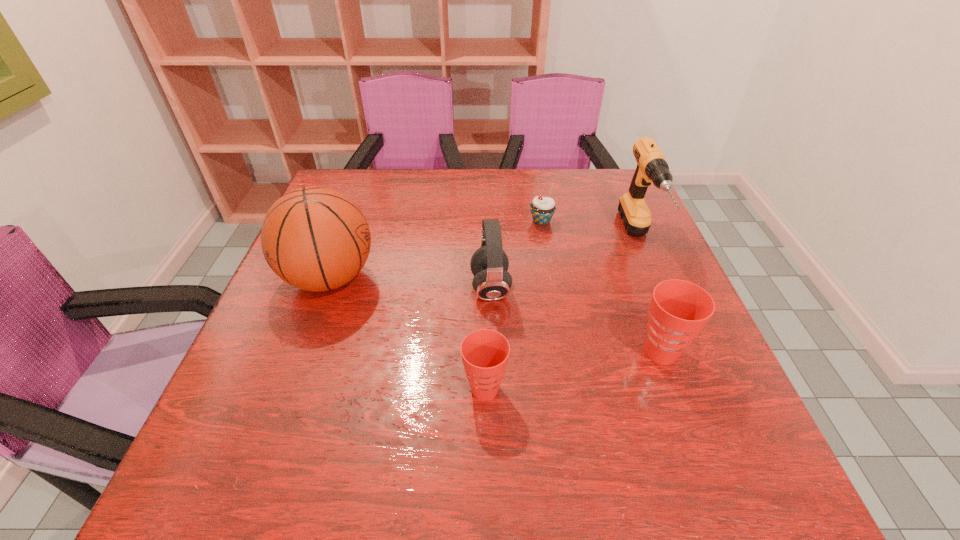
Where is `free space for a new cup on the left`? The image size is (960, 540). free space for a new cup on the left is located at coordinates (280, 431).